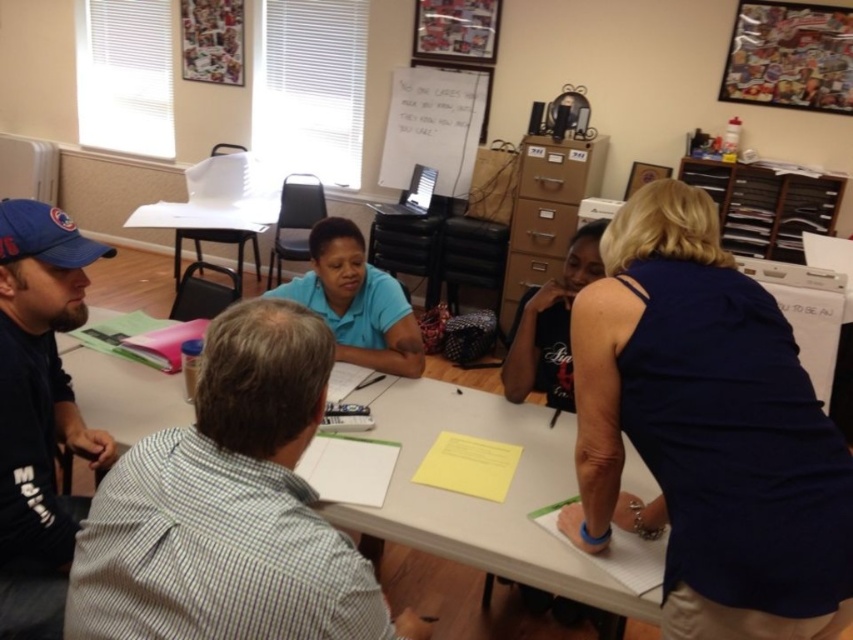
Question: Which point is closer to the camera?

Choices:
 (A) white paper at center
 (B) dark blue sleeveless top at upper right
 (C) blue shirt at center

Answer: (B)

Question: Does white paper at center lie behind blue shirt at center?

Choices:
 (A) no
 (B) yes

Answer: (A)

Question: Which point is closer to the camera?

Choices:
 (A) (332, 285)
 (B) (717, 349)
 (C) (447, 72)
 (D) (433, 436)

Answer: (B)

Question: Does blue shirt at center have a larger size compared to white paperboard at upper center?

Choices:
 (A) yes
 (B) no

Answer: (B)

Question: Observing the image, what is the correct spatial positioning of dark blue sleeveless top at upper right in reference to blue shirt at center?

Choices:
 (A) right
 (B) left

Answer: (A)

Question: Which object is farther from the camera taking this photo?

Choices:
 (A) blue shirt at center
 (B) dark blue sleeveless top at upper right
 (C) white paper at center
 (D) white paperboard at upper center

Answer: (D)